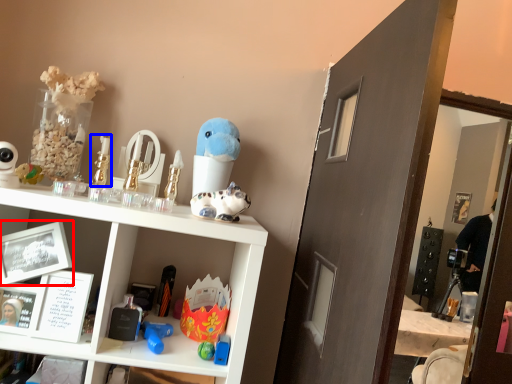
Question: Among these objects, which one is nearest to the camera, picture frame (highlighted by a red box) or toy (highlighted by a blue box)?

Choices:
 (A) picture frame
 (B) toy

Answer: (A)